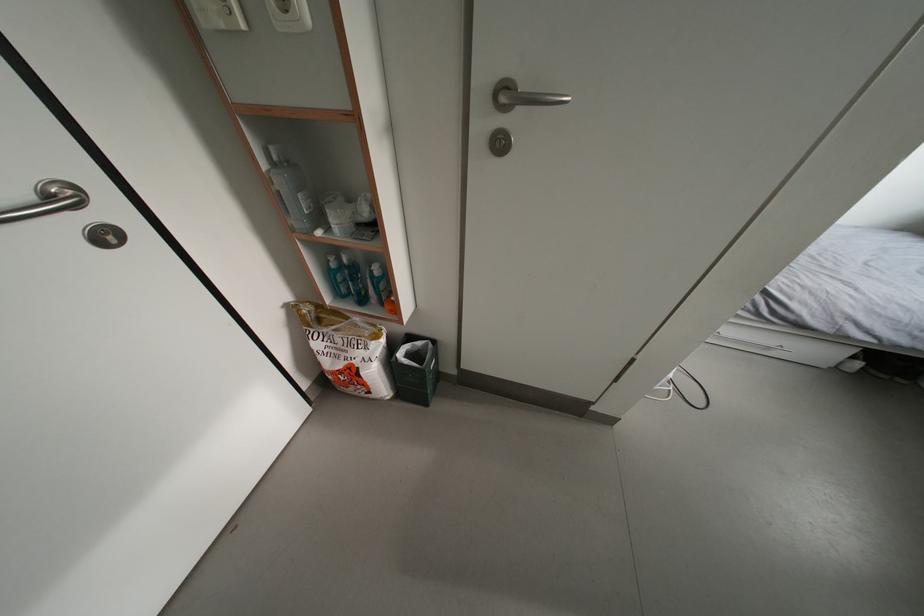
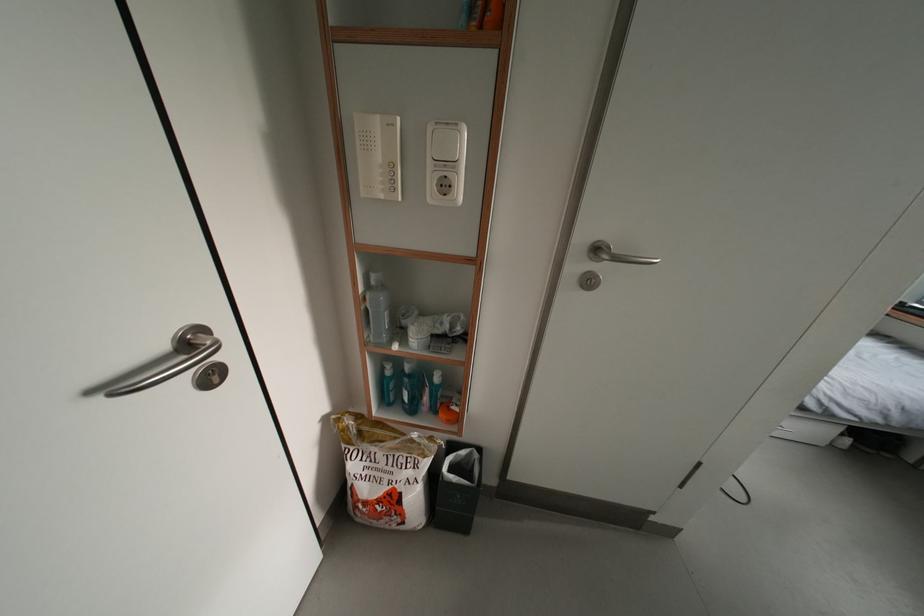
Question: The first image is from the beginning of the video and the second image is from the end. How did the camera likely rotate when shooting the video?

Choices:
 (A) Left
 (B) Right
 (C) Up
 (D) Down

Answer: (C)